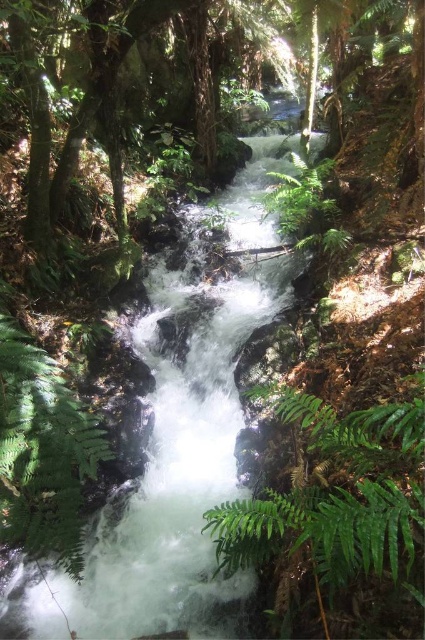
You are a hiker who wants to place a small 1 foot wide rock between the green leafy fern at center and the green fuzzy fern at lower left. Can you fit it without overlapping either fern?

The distance between the green leafy fern at center and the green fuzzy fern at lower left is 3.59 feet. Since the rock is only 1 foot wide, there is enough space to place it between them without overlapping either fern.

You are a hiker trying to cross the stream in the forest. You see a green leafy fern at center and a green fuzzy fern at lower left. Which fern could provide a wider base to place your foot on while crossing?

The green leafy fern at center might be wider than the green fuzzy fern at lower left, so it could provide a wider base for placing your foot.